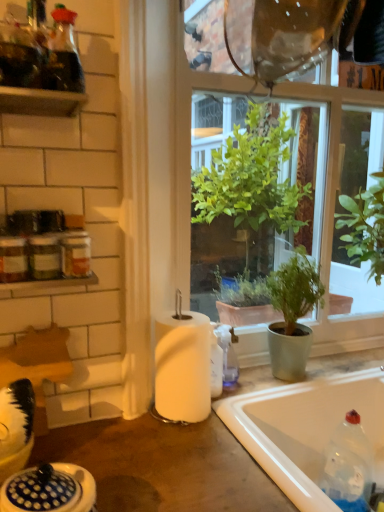
What is the approximate width of matte white countertop at center?

It is 23.14 inches.

What do you see at coordinates (348, 466) in the screenshot? The width and height of the screenshot is (384, 512). I see `clear plastic bottle at lower right` at bounding box center [348, 466].

What is the approximate width of green matte plant at center?

6.15 inches.

Identify the location of white glossy bathtub at lower right. Image resolution: width=384 pixels, height=512 pixels. 305,429.

At what (x,y) coordinates should I click in order to perform the action: click on houseplant behind the white glossy bathtub at lower right. Please return your answer as a coordinate pair (x, y). Looking at the image, I should click on (292, 314).

Does green matte plant at center have a greater height compared to white glossy bathtub at lower right?

Indeed, green matte plant at center has a greater height compared to white glossy bathtub at lower right.

From a real-world perspective, which object stands above the other?

green matte plant at center is physically above.

Considering the positions of point (68, 461) and point (297, 366), is point (68, 461) closer or farther from the camera than point (297, 366)?

Clearly, point (68, 461) is closer to the camera than point (297, 366).

Considering the positions of objects matte white countertop at center and green matte plant at center in the image provided, who is behind, matte white countertop at center or green matte plant at center?

green matte plant at center is further away from the camera.

Looking at this image, is matte white countertop at center far away from green matte plant at center?

They are positioned close to each other.

Which is more to the left, clear plastic bottle at lower right or wooden shelf at upper left?

From the viewer's perspective, wooden shelf at upper left appears more on the left side.

Considering the relative sizes of clear plastic bottle at lower right and wooden shelf at upper left in the image provided, is clear plastic bottle at lower right smaller than wooden shelf at upper left?

No.

Is clear plastic bottle at lower right not close to wooden shelf at upper left?

Actually, clear plastic bottle at lower right and wooden shelf at upper left are a little close together.

Would you say clear plastic bottle at lower right is inside or outside wooden shelf at upper left?

clear plastic bottle at lower right lies outside wooden shelf at upper left.

The height and width of the screenshot is (512, 384). What are the coordinates of `sink below the wooden shelf at upper left (from the image's perspective)` in the screenshot? It's located at (49, 489).

Which object is closer to the camera taking this photo, white glossy sink at lower left or wooden shelf at upper left?

white glossy sink at lower left.

From the image's perspective, would you say white glossy sink at lower left is positioned over wooden shelf at upper left?

No, from the image's perspective, white glossy sink at lower left is not above wooden shelf at upper left.

In terms of size, does white glossy sink at lower left appear bigger or smaller than wooden shelf at upper left?

white glossy sink at lower left is bigger than wooden shelf at upper left.

From the image's perspective, is white glossy shelf at upper left under wooden shelf at upper left?

Indeed, from the image's perspective, white glossy shelf at upper left is shown beneath wooden shelf at upper left.

Does white glossy shelf at upper left lie behind wooden shelf at upper left?

Yes, it is.

Is wooden shelf at upper left inside white glossy shelf at upper left?

Definitely not — wooden shelf at upper left is not inside white glossy shelf at upper left.

Between white glossy shelf at upper left and wooden shelf at upper left, which one appears on the left side from the viewer's perspective?

Positioned to the left is wooden shelf at upper left.

Image resolution: width=384 pixels, height=512 pixels. Find the location of `houseplant beneath the white glossy shelf at upper left (from a real-world perspective)`. houseplant beneath the white glossy shelf at upper left (from a real-world perspective) is located at coordinates (292, 314).

From a real-world perspective, does white glossy shelf at upper left stand above green matte plant at center?

Yes, from a real-world perspective, white glossy shelf at upper left is above green matte plant at center.

From the image's perspective, would you say white glossy shelf at upper left is shown under green matte plant at center?

No.

In the scene shown: Between white glossy shelf at upper left and green matte plant at center, which one has more height?

green matte plant at center is taller.

From the image's perspective, which object appears higher, transparent glass window at center or white glossy shelf at upper left?

From the image's view, transparent glass window at center is above.

Considering the relative sizes of transparent glass window at center and white glossy shelf at upper left in the image provided, is transparent glass window at center bigger than white glossy shelf at upper left?

Yes, transparent glass window at center is bigger than white glossy shelf at upper left.

Is transparent glass window at center taller than white glossy shelf at upper left?

Indeed, transparent glass window at center has a greater height compared to white glossy shelf at upper left.

You are a GUI agent. You are given a task and a screenshot of the screen. Output one action in this format:
    pyautogui.click(x=<x>, y=<y>)
    Task: Click on the bathtub that is on the right side of green matte plant at center
    Image resolution: width=384 pixels, height=512 pixels.
    Given the screenshot: What is the action you would take?
    pyautogui.click(x=305, y=429)

Find the location of a particular element. Image resolution: width=384 pixels, height=512 pixels. houseplant above the matte white countertop at center (from a real-world perspective) is located at coordinates (292, 314).

Looking at the image, which one is located further to clear plastic bottle at lower right, white matte paper towel at center or wooden shelf at upper left?

wooden shelf at upper left.

Which object lies nearer to the anchor point white glossy sink at lower left, clear plastic bottle at lower right or wooden shelf at upper left?

Based on the image, wooden shelf at upper left appears to be nearer to white glossy sink at lower left.

Based on their spatial positions, is white matte paper towel at center or matte white countertop at center closer to wooden shelf at upper left?

white matte paper towel at center is positioned closer to the anchor wooden shelf at upper left.

Estimate the real-world distances between objects in this image. Which object is further from white matte paper towel at center, white glossy bathtub at lower right or white glossy sink at lower left?

white glossy sink at lower left is further to white matte paper towel at center.

Estimate the real-world distances between objects in this image. Which object is closer to transparent glass window at center, white matte paper towel at center or white glossy bathtub at lower right?

Based on the image, white glossy bathtub at lower right appears to be nearer to transparent glass window at center.

When comparing their distances from green matte plant at center, does matte white countertop at center or white matte paper towel at center seem further?

The object further to green matte plant at center is matte white countertop at center.

Looking at the image, which one is located closer to white glossy shelf at upper left, matte white countertop at center or transparent glass window at center?

The object closer to white glossy shelf at upper left is matte white countertop at center.

Estimate the real-world distances between objects in this image. Which object is further from white glossy shelf at upper left, green matte plant at center or matte white countertop at center?

The object further to white glossy shelf at upper left is green matte plant at center.

Identify the location of bottle located between white glossy shelf at upper left and white glossy bathtub at lower right in the left-right direction. The height and width of the screenshot is (512, 384). (348, 466).

At what (x,y) coordinates should I click in order to perform the action: click on window sill between white glossy sink at lower left and white matte paper towel at center from front to back. Please return your answer as a coordinate pair (x, y). Looking at the image, I should click on (45, 286).

Locate an element on the screen. houseplant located between white glossy shelf at upper left and clear plastic bottle at lower right in the left-right direction is located at coordinates (292, 314).

Locate an element on the screen. The height and width of the screenshot is (512, 384). bathtub between matte white countertop at center and clear plastic bottle at lower right along the z-axis is located at coordinates (305, 429).